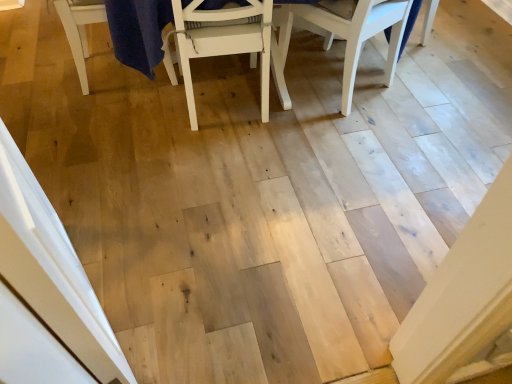
Question: Are white matte chair at center, which is the first chair from left to right, and white wood chair at upper right, marked as the 2th chair in a left-to-right arrangement, beside each other?

Choices:
 (A) no
 (B) yes

Answer: (A)

Question: Is white matte chair at center, placed as the 2th chair when sorted from right to left, at the left side of white wood chair at upper right, marked as the 2th chair in a left-to-right arrangement?

Choices:
 (A) no
 (B) yes

Answer: (B)

Question: Does white matte chair at center, which is the first chair from left to right, come in front of white wood chair at upper right, marked as the 2th chair in a left-to-right arrangement?

Choices:
 (A) yes
 (B) no

Answer: (A)

Question: Can you confirm if white matte chair at center, which is the first chair from left to right, is shorter than white wood chair at upper right, marked as the 2th chair in a left-to-right arrangement?

Choices:
 (A) yes
 (B) no

Answer: (B)

Question: Is white wood chair at upper right, marked as the 2th chair in a left-to-right arrangement, a part of white matte chair at center, which is the first chair from left to right?

Choices:
 (A) yes
 (B) no

Answer: (B)

Question: From a real-world perspective, is white matte chair at center, which is the first chair from left to right, beneath white wood chair at upper right, which is the first chair in right-to-left order?

Choices:
 (A) no
 (B) yes

Answer: (A)

Question: Is white wood chair at upper right, which is the first chair in right-to-left order, positioned in front of white matte chair at center, placed as the 2th chair when sorted from right to left?

Choices:
 (A) no
 (B) yes

Answer: (A)

Question: Is there a large distance between white wood chair at upper right, marked as the 2th chair in a left-to-right arrangement, and white matte chair at center, which is the first chair from left to right?

Choices:
 (A) yes
 (B) no

Answer: (B)

Question: Is white wood chair at upper right, which is the first chair in right-to-left order, positioned behind white matte chair at center, placed as the 2th chair when sorted from right to left?

Choices:
 (A) yes
 (B) no

Answer: (A)

Question: Does white wood chair at upper right, which is the first chair in right-to-left order, have a smaller size compared to white matte chair at center, which is the first chair from left to right?

Choices:
 (A) yes
 (B) no

Answer: (A)

Question: Considering the relative sizes of white wood chair at upper right, which is the first chair in right-to-left order, and white matte chair at center, placed as the 2th chair when sorted from right to left, in the image provided, is white wood chair at upper right, which is the first chair in right-to-left order, bigger than white matte chair at center, placed as the 2th chair when sorted from right to left,?

Choices:
 (A) yes
 (B) no

Answer: (B)

Question: From a real-world perspective, is white wood chair at upper right, which is the first chair in right-to-left order, physically above white matte chair at center, which is the first chair from left to right?

Choices:
 (A) no
 (B) yes

Answer: (A)

Question: Looking at the image, does white wood chair at upper right, which is the first chair in right-to-left order, seem bigger or smaller compared to white matte chair at center, which is the first chair from left to right?

Choices:
 (A) big
 (B) small

Answer: (B)